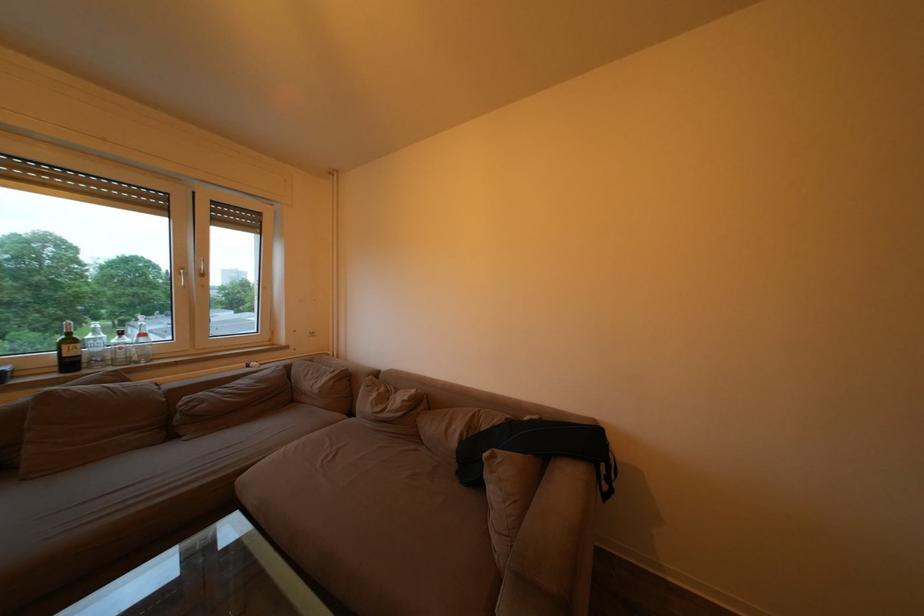
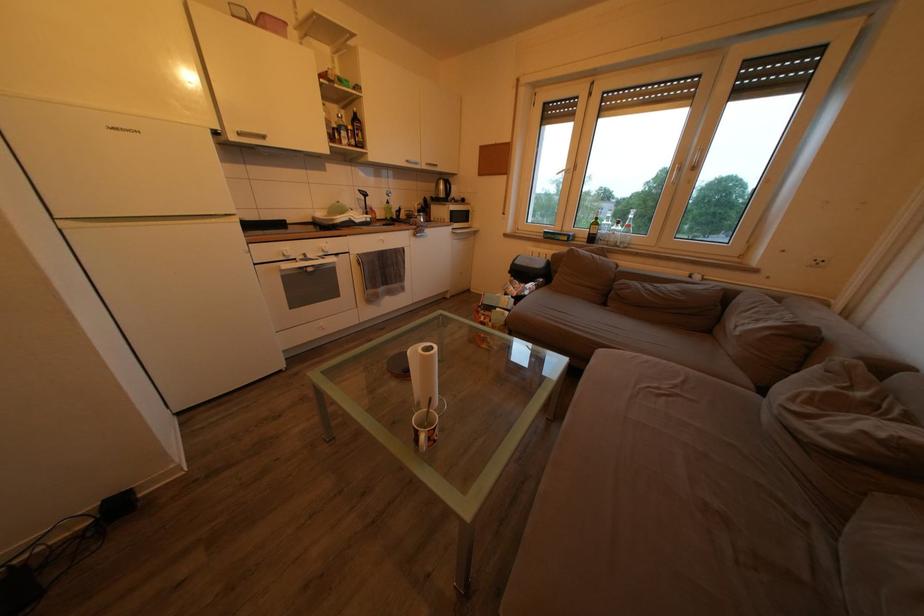
First-person continuous shooting, in which direction is the camera rotating?

The camera's rotation is toward left-down.